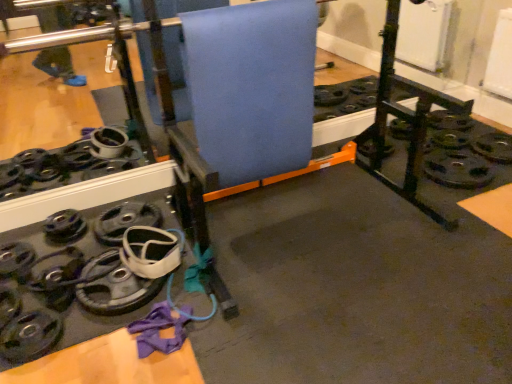
What are the coordinates of `blank space situated above black rubber weight at lower left (from a real-world perspective)` in the screenshot? It's located at (34, 326).